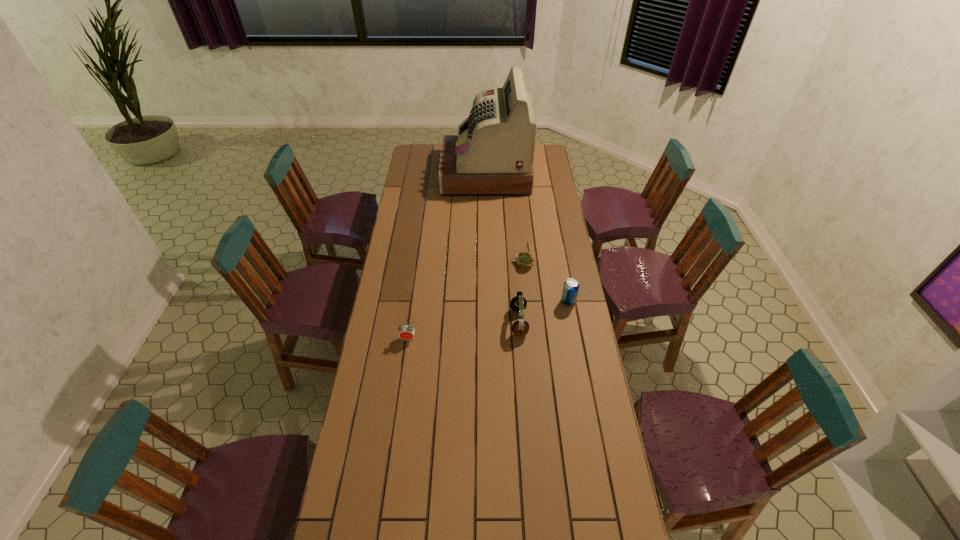
Find the location of `vacant space located 0.350m on the ear cups of the headset`. vacant space located 0.350m on the ear cups of the headset is located at coordinates (x=424, y=322).

I want to click on vacant space located on the ear cups of the headset, so click(x=464, y=322).

You are a GUI agent. You are given a task and a screenshot of the screen. Output one action in this format:
    pyautogui.click(x=<x>, y=<y>)
    Task: Click on the vacant space located 0.370m on the left of the beer can
    
    Given the screenshot: What is the action you would take?
    pyautogui.click(x=473, y=301)

Where is `free location located with the dial facing the compass`? free location located with the dial facing the compass is located at coordinates (490, 262).

Find the location of a particular element. The height and width of the screenshot is (540, 960). free location located with the dial facing the compass is located at coordinates (479, 262).

Identify the location of vacant point located with the dial facing the compass. Image resolution: width=960 pixels, height=540 pixels. (488, 262).

This screenshot has width=960, height=540. I want to click on free region located on the face of the leftmost object, so click(x=404, y=369).

Identify the location of object present at the far edge. (492, 155).

Identify the location of object that is at the left edge. (406, 332).

Locate an element on the screen. The width and height of the screenshot is (960, 540). cash register positioned at the right edge is located at coordinates (492, 155).